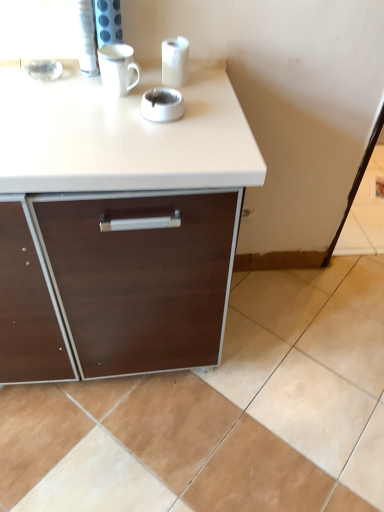
Where is `free spot above beige ceramic tile at lower right (from a real-world perspective)`? The height and width of the screenshot is (512, 384). free spot above beige ceramic tile at lower right (from a real-world perspective) is located at coordinates (267, 382).